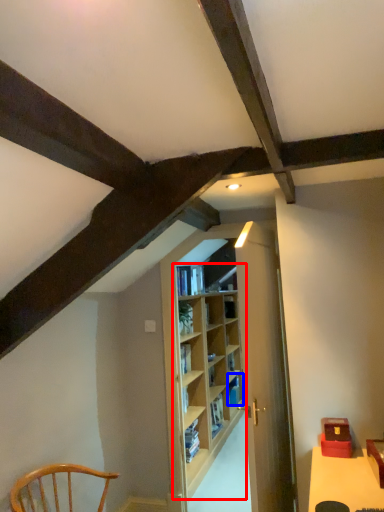
Question: Among these objects, which one is nearest to the camera, shelf (highlighted by a red box) or book (highlighted by a blue box)?

Choices:
 (A) shelf
 (B) book

Answer: (A)